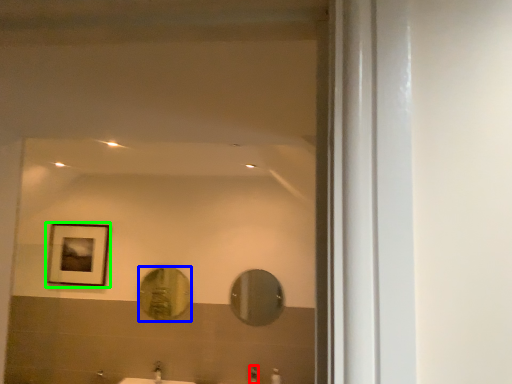
Question: Estimate the real-world distances between objects in this image. Which object is farther from faucet (highlighted by a red box), mirror (highlighted by a blue box) or picture frame (highlighted by a green box)?

Choices:
 (A) mirror
 (B) picture frame

Answer: (B)